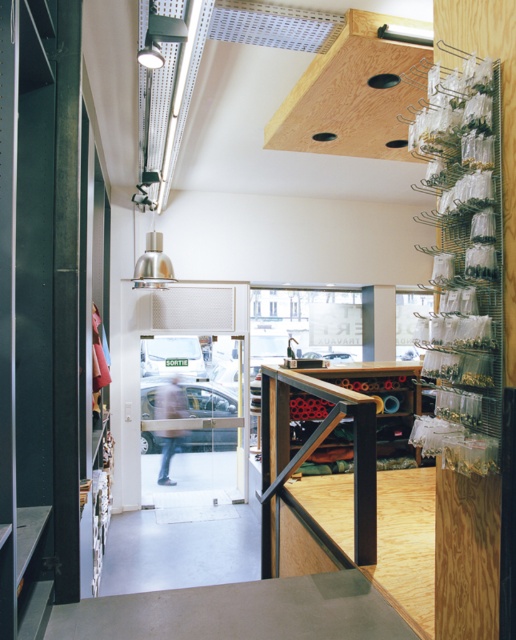
You are a customer in the store and want to place a large gift box on the counter. Which counter, the smooth concrete counter top at center or the plywood counter at center, can accommodate the gift box if it requires a wider space?

The smooth concrete counter top at center has a larger width than the plywood counter at center, so it can accommodate the gift box that requires a wider space.

You are a customer entering the store and want to place a small item on the counter. Which counter should you use, the smooth concrete counter top at center or the plywood counter at center?

The smooth concrete counter top at center is located below the plywood counter at center, so the plywood counter at center is the one at a higher level. Since you want to place an item on the counter, you should choose the plywood counter at center as it is more accessible from the standing position.